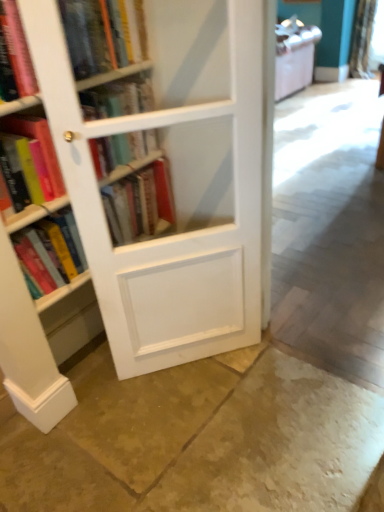
Question: From a real-world perspective, is hardcover book at left, arranged as the third book when ordered from the bottom, physically located above or below matte pink book at left, placed as the fifth book when sorted from bottom to top?

Choices:
 (A) below
 (B) above

Answer: (A)

Question: Considering their positions, is hardcover book at left, arranged as the third book when ordered from the bottom, located in front of or behind matte pink book at left, placed as the 2th book when sorted from top to bottom?

Choices:
 (A) behind
 (B) front

Answer: (A)

Question: Estimate the real-world distances between objects in this image. Which object is closer to the white wood bookcase at left?

Choices:
 (A) hardcover book at left, which appears as the fourth book when viewed from the top
 (B) hardcover book at center, marked as the fifth book in a top-to-bottom arrangement
 (C) matte pink book at left, placed as the 2th book when sorted from top to bottom
 (D) hardcover book at left, marked as the 4th book in a bottom-to-top arrangement
 (E) smooth concrete floor at center, the 2th concrete in the bottom-to-top sequence

Answer: (B)

Question: Which is nearer to the matte hardcover book at left, arranged as the first book when ordered from the bottom?

Choices:
 (A) hardcover book at upper left, placed as the 6th book when sorted from bottom to top
 (B) white sheer curtain at upper right
 (C) hardcover book at left, which is the 3th book from top to bottom
 (D) hardcover book at center, marked as the fifth book in a top-to-bottom arrangement
 (E) matte pink book at left, placed as the fifth book when sorted from bottom to top

Answer: (D)